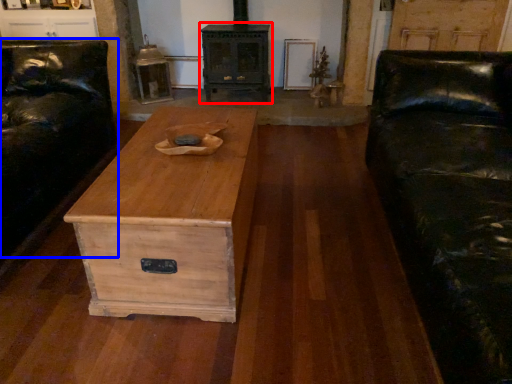
Question: Which object appears farthest to the camera in this image, stove (highlighted by a red box) or couch (highlighted by a blue box)?

Choices:
 (A) stove
 (B) couch

Answer: (A)